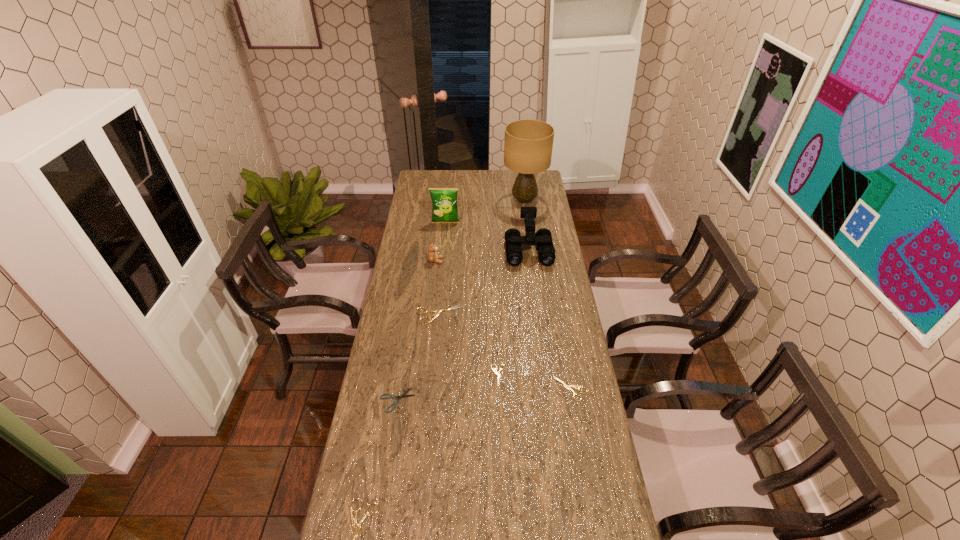
At what (x,y) coordinates should I click in order to perform the action: click on vacant region at the right edge of the desktop. Please return your answer as a coordinate pair (x, y). Looking at the image, I should click on pos(574,489).

In the image, there is a desktop. What are the coordinates of `blank space at the far left corner` in the screenshot? It's located at (416, 186).

This screenshot has height=540, width=960. Identify the location of unoccupied position between the fifth tallest object and the teddy bear. (438, 288).

Where is `vacant region between the tallest object and the third tallest shears`? Image resolution: width=960 pixels, height=540 pixels. vacant region between the tallest object and the third tallest shears is located at coordinates (547, 295).

At what (x,y) coordinates should I click in order to perform the action: click on free space between the second smallest beige shears and the seventh shortest object. Please return your answer as a coordinate pair (x, y). Looking at the image, I should click on (549, 320).

Where is `vacant point located between the fourth shears from left to right and the black shears`? Image resolution: width=960 pixels, height=540 pixels. vacant point located between the fourth shears from left to right and the black shears is located at coordinates (448, 388).

Image resolution: width=960 pixels, height=540 pixels. Identify the location of vacant space that's between the sixth shortest object and the second farthest object. (441, 241).

You are a GUI agent. You are given a task and a screenshot of the screen. Output one action in this format:
    pyautogui.click(x=<x>, y=<y>)
    Task: Click on the vacant point located between the farthest object and the rightmost shears
    
    Given the screenshot: What is the action you would take?
    pyautogui.click(x=547, y=295)

You are a GUI agent. You are given a task and a screenshot of the screen. Output one action in this format:
    pyautogui.click(x=<x>, y=<y>)
    Task: Click on the object that is the sixth closest to the nearest shears
    The width and height of the screenshot is (960, 540).
    Given the screenshot: What is the action you would take?
    pyautogui.click(x=543, y=238)

Identify which object is the third closest to the nearest shears. Please provide its 2D coordinates. Your answer should be formatted as a tuple, i.e. [(x, y)], where the tuple contains the x and y coordinates of a point satisfying the conditions above.

[(569, 387)]